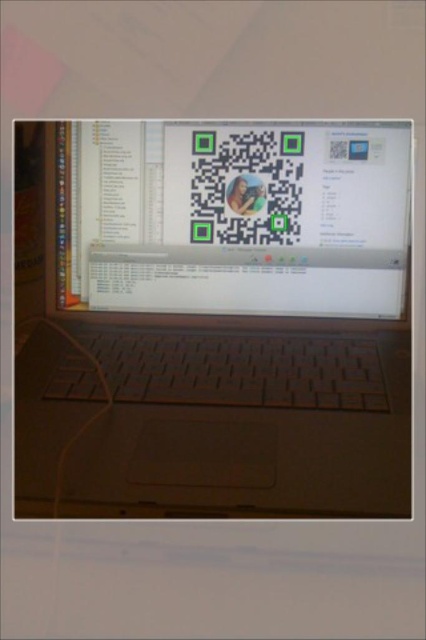
Question: Among these points, which one is farthest from the camera?

Choices:
 (A) (39, 484)
 (B) (101, 284)

Answer: (B)

Question: Is satin silver laptop at center closer to the viewer compared to white glossy qr code at center?

Choices:
 (A) yes
 (B) no

Answer: (A)

Question: Which point appears closest to the camera in this image?

Choices:
 (A) (379, 372)
 (B) (316, 141)

Answer: (A)

Question: Which of the following is the farthest from the observer?

Choices:
 (A) white glossy qr code at center
 (B) satin silver laptop at center

Answer: (A)

Question: Does satin silver laptop at center come in front of white glossy qr code at center?

Choices:
 (A) yes
 (B) no

Answer: (A)

Question: Is satin silver laptop at center positioned behind white glossy qr code at center?

Choices:
 (A) no
 (B) yes

Answer: (A)